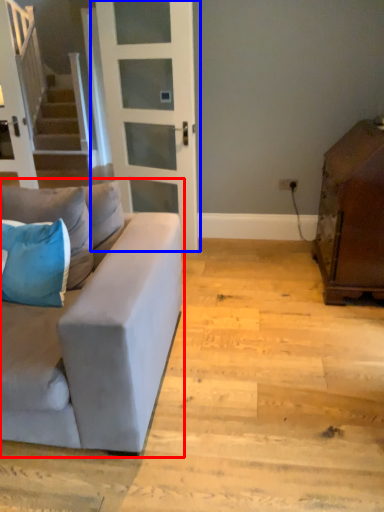
Question: Which of the following is the farthest to the observer, studio couch (highlighted by a red box) or door (highlighted by a blue box)?

Choices:
 (A) studio couch
 (B) door

Answer: (B)